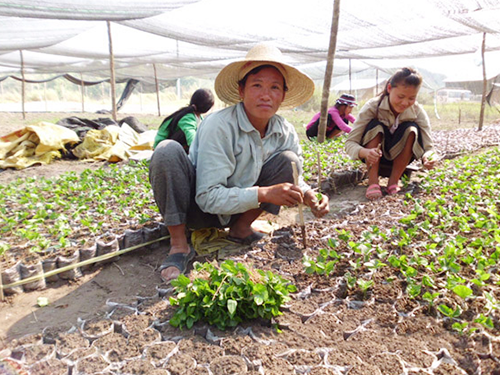
The height and width of the screenshot is (375, 500). What are the coordinates of `shade` in the screenshot? It's located at (204, 21).